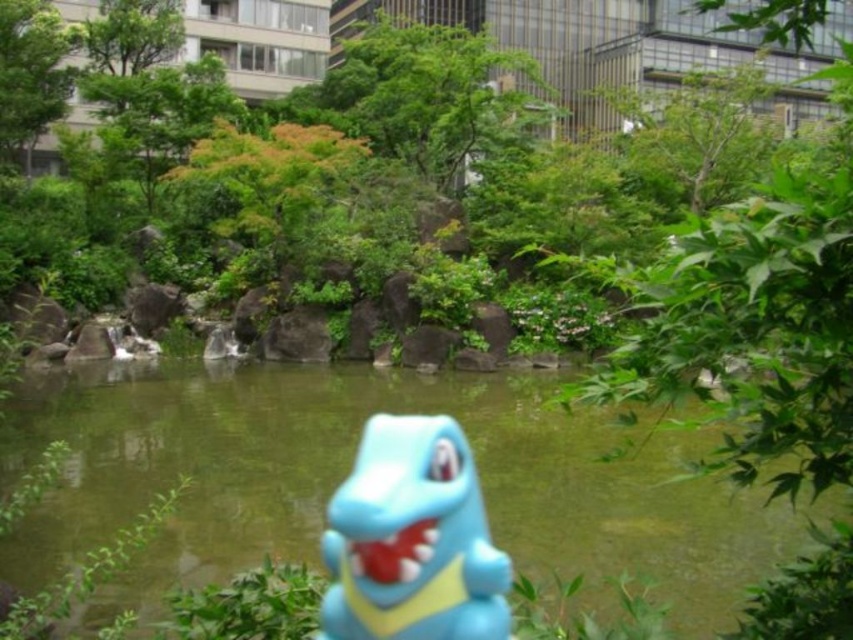
Based on the photo, you are standing in the park and want to find the green translucent water at center. Based on the coordinates provided, which direction should you look to locate it?

The green translucent water at center is located at coordinates point (349, 468), so you should look towards the center of the image to find it.

You are a child playing in the park and want to reach the blue rubber dinosaur at center without stepping into the green translucent water at center. Can you walk around the water to reach the dinosaur?

The green translucent water at center is positioned on the left side of the blue rubber dinosaur at center. Therefore, you can walk around the water on the right side to reach the dinosaur without stepping into the water.